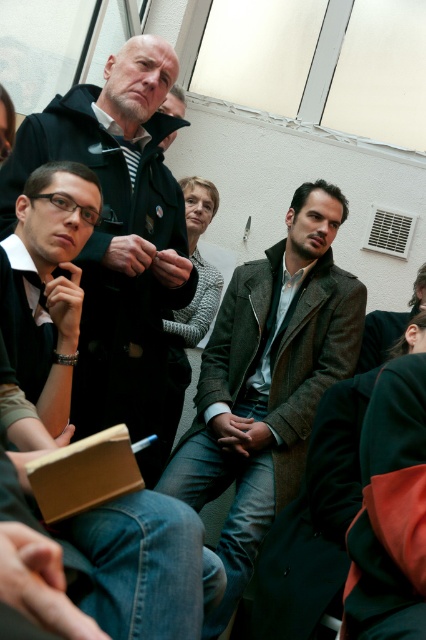
You are a tailor who needs to determine which coat requires more fabric for alterations. Based on the image, which coat has a greater width between the brown woolen coat at center and the dark gray wool coat at center?

The brown woolen coat at center has a greater width than the dark gray wool coat at center, so it requires more fabric for alterations.

In the scene shown: You are organizing a coat rack for the group in the image. Both the brown woolen coat at center and the matte black jacket at center need to be hung. Given their sizes, which one requires a larger hanger?

The brown woolen coat at center requires a larger hanger because it is larger in size than the matte black jacket at center.

You are standing in a room with a brown woolen coat at center. Where exactly is the brown woolen coat located in terms of coordinates?

The brown woolen coat at center is located at coordinates point (267, 381).